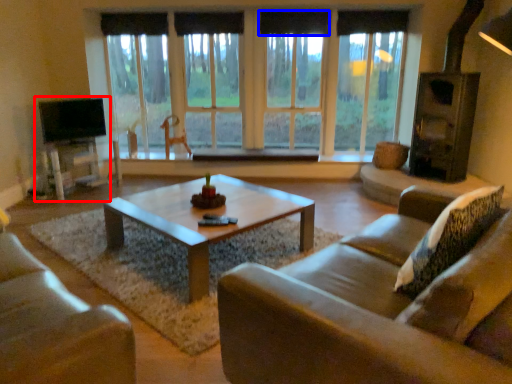
Question: Among these objects, which one is nearest to the camera, entertainment center (highlighted by a red box) or curtain (highlighted by a blue box)?

Choices:
 (A) entertainment center
 (B) curtain

Answer: (A)